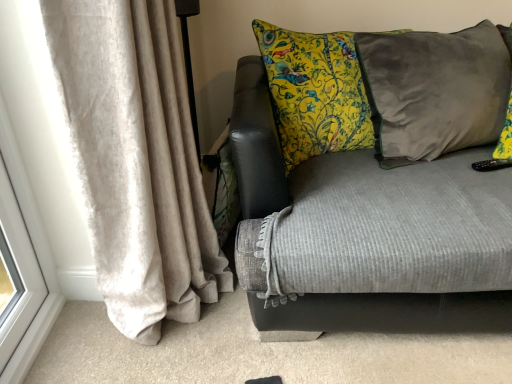
Question: Does velvet gray couch at center have a greater width compared to velvet gray pillow at right?

Choices:
 (A) yes
 (B) no

Answer: (A)

Question: Is velvet gray pillow at right at the back of velvet gray couch at center?

Choices:
 (A) no
 (B) yes

Answer: (B)

Question: Does velvet gray couch at center contain velvet gray pillow at right?

Choices:
 (A) no
 (B) yes

Answer: (B)

Question: Does velvet gray couch at center have a greater height compared to velvet gray pillow at right?

Choices:
 (A) no
 (B) yes

Answer: (B)

Question: Is velvet gray couch at center with velvet gray pillow at right?

Choices:
 (A) no
 (B) yes

Answer: (A)

Question: From the image's perspective, relative to velvet gray pillow at right, is velvet gray couch at center above or below?

Choices:
 (A) above
 (B) below

Answer: (B)

Question: Looking at their shapes, would you say velvet gray couch at center is wider or thinner than velvet gray pillow at right?

Choices:
 (A) wide
 (B) thin

Answer: (A)

Question: From their relative heights in the image, would you say velvet gray couch at center is taller or shorter than velvet gray pillow at right?

Choices:
 (A) short
 (B) tall

Answer: (B)

Question: Considering their positions, is velvet gray couch at center located in front of or behind velvet gray pillow at right?

Choices:
 (A) front
 (B) behind

Answer: (A)

Question: Is velvet gray pillow at right bigger or smaller than velvet gray couch at center?

Choices:
 (A) big
 (B) small

Answer: (B)

Question: From a real-world perspective, relative to velvet gray couch at center, is velvet gray pillow at right vertically above or below?

Choices:
 (A) below
 (B) above

Answer: (B)

Question: Considering the positions of velvet gray pillow at right and velvet gray couch at center in the image, is velvet gray pillow at right wider or thinner than velvet gray couch at center?

Choices:
 (A) wide
 (B) thin

Answer: (B)

Question: Is velvet gray pillow at right spatially inside velvet gray couch at center, or outside of it?

Choices:
 (A) inside
 (B) outside

Answer: (A)

Question: Relative to velvet gray couch at center, is beige velvet curtain at left in front or behind?

Choices:
 (A) behind
 (B) front

Answer: (B)

Question: Is beige velvet curtain at left to the left or to the right of velvet gray couch at center in the image?

Choices:
 (A) left
 (B) right

Answer: (A)